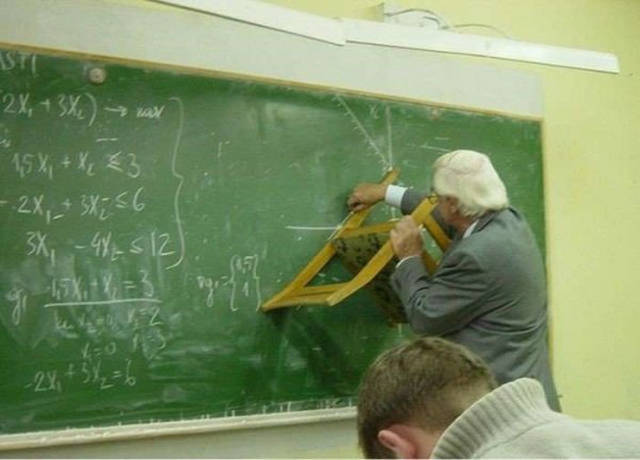
Find the location of a particular element. The height and width of the screenshot is (460, 640). backrest is located at coordinates (326, 290).